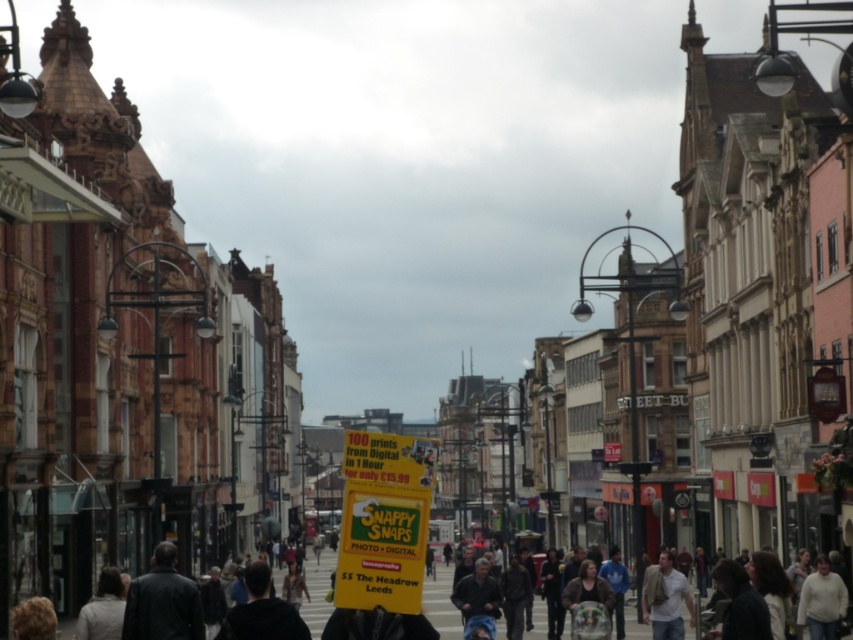
Is leather jacket at lower left positioned before light beige sweater at lower right?

Yes, it is.

Which is above, leather jacket at lower left or light beige sweater at lower right?

Positioned higher is leather jacket at lower left.

Does point (198, 605) come behind point (798, 614)?

No, it is in front of (798, 614).

At what (x,y) coordinates should I click in order to perform the action: click on leather jacket at lower left. Please return your answer as a coordinate pair (x, y). Looking at the image, I should click on 161,602.

Consider the image. Between leather jacket at lower left and light brown leather jacket at lower right, which one appears on the right side from the viewer's perspective?

From the viewer's perspective, light brown leather jacket at lower right appears more on the right side.

Who is more distant from viewer, (196,609) or (682,588)?

Point (682,588)

I want to click on leather jacket at lower left, so point(161,602).

Between point (276, 579) and point (837, 595), which one is positioned in front?

Point (837, 595) is in front.

Between concrete pavement at lower center and light beige sweater at lower right, which one appears on the right side from the viewer's perspective?

light beige sweater at lower right

Does point (531, 636) come behind point (840, 605)?

Yes, point (531, 636) is farther from viewer.

I want to click on concrete pavement at lower center, so click(440, 604).